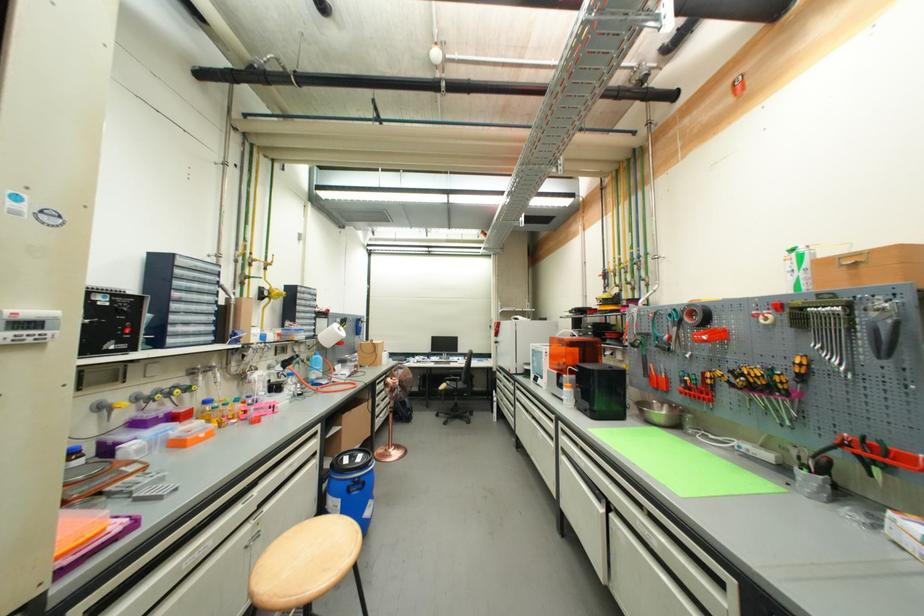
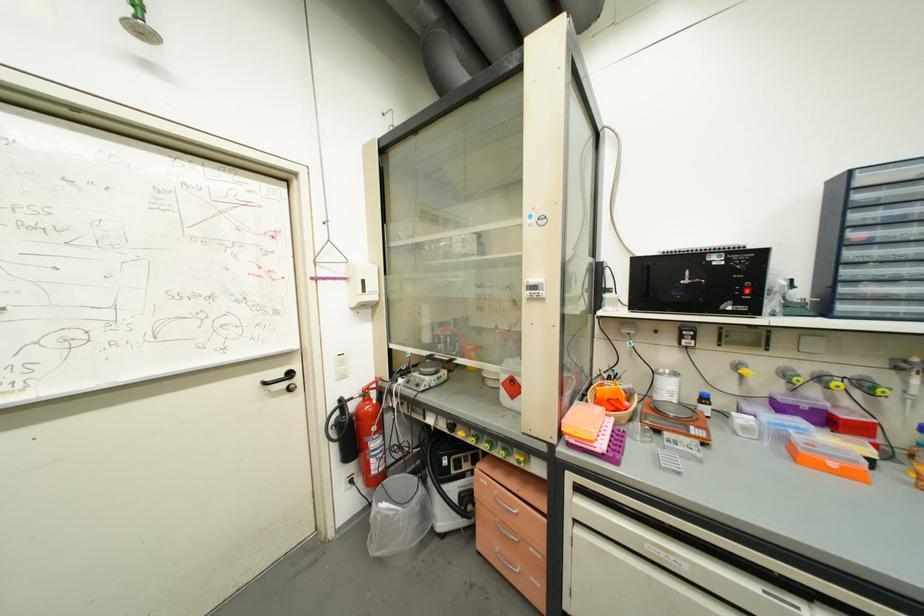
Find the pixel in the second image that matches point 201,373 in the first image.

(909, 367)